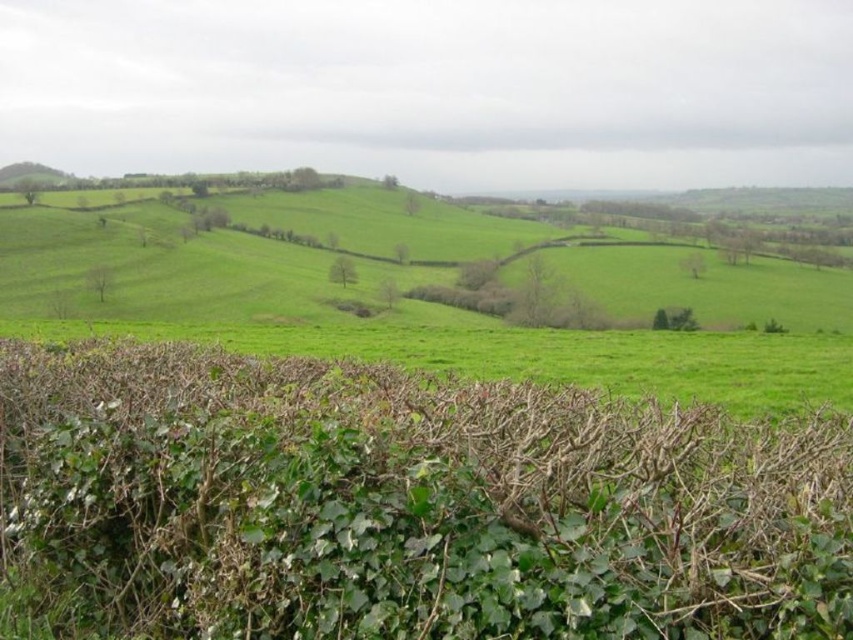
Describe the element at coordinates (405, 502) in the screenshot. I see `green leafy hedge at lower center` at that location.

Which is in front, point (543, 436) or point (10, 170)?

Point (543, 436)

I want to click on green leafy hedge at lower center, so click(405, 502).

Does green leafy hedge at lower center have a lesser width compared to green grassy field at lower left?

Yes.

Does green leafy hedge at lower center come in front of green grassy field at lower left?

Yes, it is.

Does point (643, 586) lie behind point (613, 346)?

No, (643, 586) is closer to viewer.

At what (x,y) coordinates should I click in order to perform the action: click on green leafy hedge at lower center. Please return your answer as a coordinate pair (x, y). Looking at the image, I should click on (405, 502).

Which is above, green grassy field at lower left or green grassy hillside at left?

green grassy hillside at left

Is point (432, 365) closer to viewer compared to point (4, 170)?

Yes, point (432, 365) is closer to viewer.

The width and height of the screenshot is (853, 640). Find the location of `green grassy field at lower left`. green grassy field at lower left is located at coordinates (432, 308).